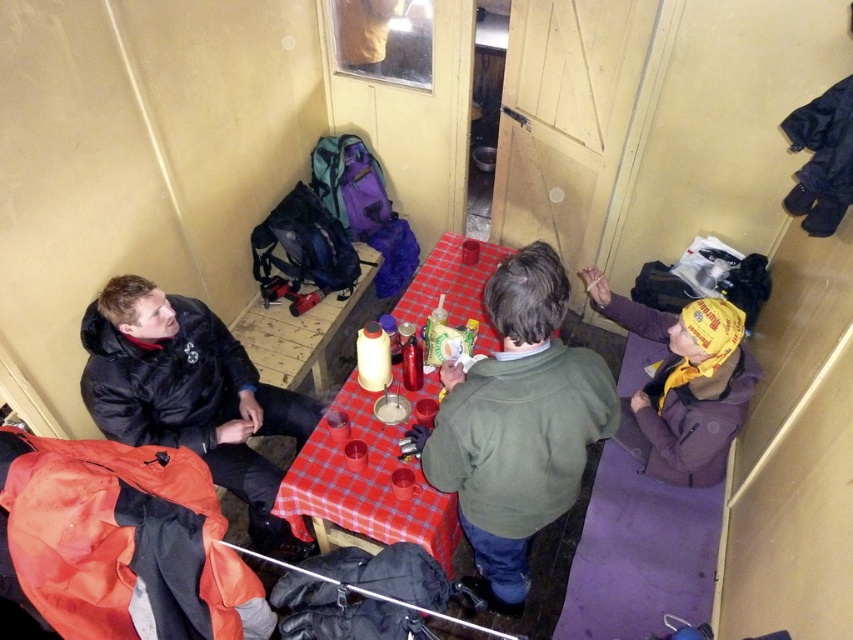
Is red checkered tablecloth at center thinner than yellow fabric headband at right?

No, red checkered tablecloth at center is not thinner than yellow fabric headband at right.

Find the location of a particular element. red checkered tablecloth at center is located at coordinates (364, 484).

Which is more to the right, green matte sweater at center or black matte jacket at left?

green matte sweater at center is more to the right.

Measure the distance between green matte sweater at center and camera.

They are 1.49 meters apart.

Where is `green matte sweater at center`? This screenshot has width=853, height=640. green matte sweater at center is located at coordinates (515, 426).

Is green matte sweater at center smaller than yellow fabric headband at right?

Incorrect, green matte sweater at center is not smaller in size than yellow fabric headband at right.

Is point (526, 552) less distant than point (732, 426)?

That is False.

Where is `green matte sweater at center`? green matte sweater at center is located at coordinates (515, 426).